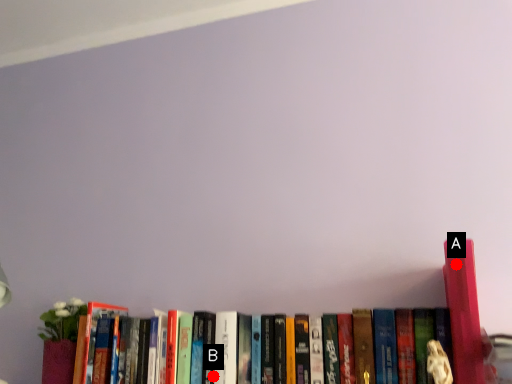
Question: Two points are circled on the image, labeled by A and B beside each circle. Among these points, which one is farthest from the camera?

Choices:
 (A) A is further
 (B) B is further

Answer: (B)